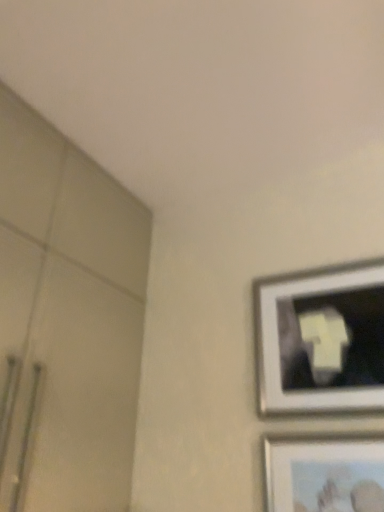
You are a GUI agent. You are given a task and a screenshot of the screen. Output one action in this format:
    pyautogui.click(x=<x>, y=<y>)
    Task: Click on the metallic silver picture frame at upper right, which is counted as the 1th picture frame, starting from the top
    The width and height of the screenshot is (384, 512).
    Given the screenshot: What is the action you would take?
    pyautogui.click(x=321, y=339)

The height and width of the screenshot is (512, 384). What do you see at coordinates (321, 339) in the screenshot?
I see `metallic silver picture frame at upper right, the 2th picture frame when ordered from bottom to top` at bounding box center [321, 339].

What is the approximate height of metallic silver picture frame at upper right, which is counted as the 1th picture frame, starting from the top?

It is 17.50 inches.

Image resolution: width=384 pixels, height=512 pixels. Identify the location of matte silver picture frame at lower right, the first picture frame ordered from the bottom. (324, 473).

The image size is (384, 512). What do you see at coordinates (324, 473) in the screenshot? I see `matte silver picture frame at lower right, positioned as the second picture frame in top-to-bottom order` at bounding box center [324, 473].

Where is `metallic silver picture frame at upper right, the 2th picture frame when ordered from bottom to top`? metallic silver picture frame at upper right, the 2th picture frame when ordered from bottom to top is located at coordinates (321, 339).

Considering the relative positions of matte silver picture frame at lower right, positioned as the second picture frame in top-to-bottom order, and metallic silver picture frame at upper right, the 2th picture frame when ordered from bottom to top, in the image provided, is matte silver picture frame at lower right, positioned as the second picture frame in top-to-bottom order, to the left of metallic silver picture frame at upper right, the 2th picture frame when ordered from bottom to top, from the viewer's perspective?

Incorrect, matte silver picture frame at lower right, positioned as the second picture frame in top-to-bottom order, is not on the left side of metallic silver picture frame at upper right, the 2th picture frame when ordered from bottom to top.

Between matte silver picture frame at lower right, the first picture frame ordered from the bottom, and metallic silver picture frame at upper right, which is counted as the 1th picture frame, starting from the top, which one is positioned in front?

matte silver picture frame at lower right, the first picture frame ordered from the bottom, is closer to the camera.

Considering the positions of point (305, 490) and point (301, 292), is point (305, 490) closer or farther from the camera than point (301, 292)?

Point (305, 490).

From the image's perspective, is matte silver picture frame at lower right, positioned as the second picture frame in top-to-bottom order, located above metallic silver picture frame at upper right, the 2th picture frame when ordered from bottom to top?

No, from the image's perspective, matte silver picture frame at lower right, positioned as the second picture frame in top-to-bottom order, is not on top of metallic silver picture frame at upper right, the 2th picture frame when ordered from bottom to top.

From a real-world perspective, is matte silver picture frame at lower right, positioned as the second picture frame in top-to-bottom order, physically below metallic silver picture frame at upper right, which is counted as the 1th picture frame, starting from the top?

Correct, in the physical world, matte silver picture frame at lower right, positioned as the second picture frame in top-to-bottom order, is lower than metallic silver picture frame at upper right, which is counted as the 1th picture frame, starting from the top.

Is matte silver picture frame at lower right, the first picture frame ordered from the bottom, wider or thinner than metallic silver picture frame at upper right, the 2th picture frame when ordered from bottom to top?

Clearly, matte silver picture frame at lower right, the first picture frame ordered from the bottom, has less width compared to metallic silver picture frame at upper right, the 2th picture frame when ordered from bottom to top.

Is matte silver picture frame at lower right, positioned as the second picture frame in top-to-bottom order, taller or shorter than metallic silver picture frame at upper right, the 2th picture frame when ordered from bottom to top?

Considering their sizes, matte silver picture frame at lower right, positioned as the second picture frame in top-to-bottom order, has less height than metallic silver picture frame at upper right, the 2th picture frame when ordered from bottom to top.

Does matte silver picture frame at lower right, positioned as the second picture frame in top-to-bottom order, have a smaller size compared to metallic silver picture frame at upper right, the 2th picture frame when ordered from bottom to top?

Yes, matte silver picture frame at lower right, positioned as the second picture frame in top-to-bottom order, is smaller than metallic silver picture frame at upper right, the 2th picture frame when ordered from bottom to top.

Is matte silver picture frame at lower right, positioned as the second picture frame in top-to-bottom order, not within metallic silver picture frame at upper right, the 2th picture frame when ordered from bottom to top?

Yes.

Is matte silver picture frame at lower right, the first picture frame ordered from the bottom, directly adjacent to metallic silver picture frame at upper right, which is counted as the 1th picture frame, starting from the top?

No, matte silver picture frame at lower right, the first picture frame ordered from the bottom, is not beside metallic silver picture frame at upper right, which is counted as the 1th picture frame, starting from the top.

Is matte silver picture frame at lower right, the first picture frame ordered from the bottom, looking in the opposite direction of metallic silver picture frame at upper right, the 2th picture frame when ordered from bottom to top?

No, metallic silver picture frame at upper right, the 2th picture frame when ordered from bottom to top, is not at the back of matte silver picture frame at lower right, the first picture frame ordered from the bottom.

Consider the image. Can you tell me how much matte silver picture frame at lower right, the first picture frame ordered from the bottom, and metallic silver picture frame at upper right, which is counted as the 1th picture frame, starting from the top, differ in facing direction?

matte silver picture frame at lower right, the first picture frame ordered from the bottom, and metallic silver picture frame at upper right, which is counted as the 1th picture frame, starting from the top, are facing 0.0139 degrees away from each other.

How much distance is there between matte silver picture frame at lower right, the first picture frame ordered from the bottom, and metallic silver picture frame at upper right, the 2th picture frame when ordered from bottom to top?

matte silver picture frame at lower right, the first picture frame ordered from the bottom, is 22.74 centimeters from metallic silver picture frame at upper right, the 2th picture frame when ordered from bottom to top.

Image resolution: width=384 pixels, height=512 pixels. I want to click on picture frame located above the matte silver picture frame at lower right, positioned as the second picture frame in top-to-bottom order (from the image's perspective), so click(x=321, y=339).

Which is more to the left, metallic silver picture frame at upper right, which is counted as the 1th picture frame, starting from the top, or matte silver picture frame at lower right, the first picture frame ordered from the bottom?

metallic silver picture frame at upper right, which is counted as the 1th picture frame, starting from the top.

Is the position of metallic silver picture frame at upper right, the 2th picture frame when ordered from bottom to top, less distant than that of matte silver picture frame at lower right, positioned as the second picture frame in top-to-bottom order?

No, metallic silver picture frame at upper right, the 2th picture frame when ordered from bottom to top, is further to the viewer.

Considering the positions of point (287, 340) and point (321, 499), is point (287, 340) closer or farther from the camera than point (321, 499)?

Point (287, 340).

From the image's perspective, is metallic silver picture frame at upper right, which is counted as the 1th picture frame, starting from the top, located above or below matte silver picture frame at lower right, the first picture frame ordered from the bottom?

From the image's perspective, metallic silver picture frame at upper right, which is counted as the 1th picture frame, starting from the top, appears above matte silver picture frame at lower right, the first picture frame ordered from the bottom.

From a real-world perspective, which is physically above, metallic silver picture frame at upper right, the 2th picture frame when ordered from bottom to top, or matte silver picture frame at lower right, the first picture frame ordered from the bottom?

From a 3D spatial view, metallic silver picture frame at upper right, the 2th picture frame when ordered from bottom to top, is above.

Between metallic silver picture frame at upper right, which is counted as the 1th picture frame, starting from the top, and matte silver picture frame at lower right, positioned as the second picture frame in top-to-bottom order, which one has smaller width?

matte silver picture frame at lower right, positioned as the second picture frame in top-to-bottom order, is thinner.

Who is taller, metallic silver picture frame at upper right, the 2th picture frame when ordered from bottom to top, or matte silver picture frame at lower right, positioned as the second picture frame in top-to-bottom order?

Standing taller between the two is metallic silver picture frame at upper right, the 2th picture frame when ordered from bottom to top.

Considering the sizes of metallic silver picture frame at upper right, the 2th picture frame when ordered from bottom to top, and matte silver picture frame at lower right, positioned as the second picture frame in top-to-bottom order, in the image, is metallic silver picture frame at upper right, the 2th picture frame when ordered from bottom to top, bigger or smaller than matte silver picture frame at lower right, positioned as the second picture frame in top-to-bottom order,?

Clearly, metallic silver picture frame at upper right, the 2th picture frame when ordered from bottom to top, is larger in size than matte silver picture frame at lower right, positioned as the second picture frame in top-to-bottom order.

Can we say metallic silver picture frame at upper right, which is counted as the 1th picture frame, starting from the top, lies outside matte silver picture frame at lower right, the first picture frame ordered from the bottom?

metallic silver picture frame at upper right, which is counted as the 1th picture frame, starting from the top, is positioned outside matte silver picture frame at lower right, the first picture frame ordered from the bottom.

Is metallic silver picture frame at upper right, the 2th picture frame when ordered from bottom to top, touching matte silver picture frame at lower right, the first picture frame ordered from the bottom?

No, metallic silver picture frame at upper right, the 2th picture frame when ordered from bottom to top, is not with matte silver picture frame at lower right, the first picture frame ordered from the bottom.

Is metallic silver picture frame at upper right, which is counted as the 1th picture frame, starting from the top, turned away from matte silver picture frame at lower right, positioned as the second picture frame in top-to-bottom order?

That's not correct — metallic silver picture frame at upper right, which is counted as the 1th picture frame, starting from the top, is not looking away from matte silver picture frame at lower right, positioned as the second picture frame in top-to-bottom order.

Locate an element on the screen. Image resolution: width=384 pixels, height=512 pixels. picture frame to the left of matte silver picture frame at lower right, the first picture frame ordered from the bottom is located at coordinates click(x=321, y=339).

Identify the location of picture frame that appears above the matte silver picture frame at lower right, the first picture frame ordered from the bottom (from the image's perspective). The width and height of the screenshot is (384, 512). (321, 339).

Locate an element on the screen. The width and height of the screenshot is (384, 512). picture frame behind the matte silver picture frame at lower right, the first picture frame ordered from the bottom is located at coordinates (321, 339).